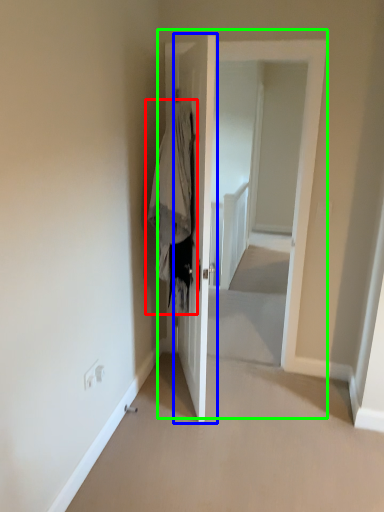
Question: Which is farther away from clothing (highlighted by a red box)? door (highlighted by a blue box) or door (highlighted by a green box)?

Choices:
 (A) door
 (B) door

Answer: (B)